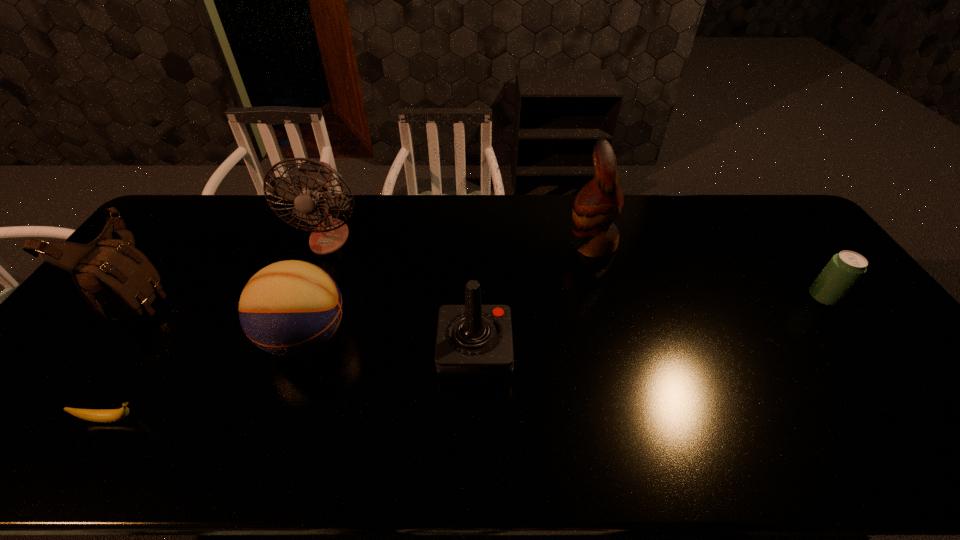
Find the location of `parrot`. parrot is located at coordinates (598, 204).

Where is `fan`? This screenshot has height=540, width=960. fan is located at coordinates (315, 177).

Where is `shoulder bag`? This screenshot has height=540, width=960. shoulder bag is located at coordinates (118, 280).

Where is `the third object from right to left`? The height and width of the screenshot is (540, 960). the third object from right to left is located at coordinates (474, 342).

The image size is (960, 540). I want to click on basketball, so click(x=289, y=308).

Where is `soda`? Image resolution: width=960 pixels, height=540 pixels. soda is located at coordinates [844, 269].

Where is `the second shortest object`? the second shortest object is located at coordinates (844, 269).

Image resolution: width=960 pixels, height=540 pixels. I want to click on the shortest object, so click(x=108, y=415).

Find the location of `the nearest object`. the nearest object is located at coordinates (108, 415).

Identify the location of vacant space located 0.210m on the face of the parrot. The image size is (960, 540). (502, 245).